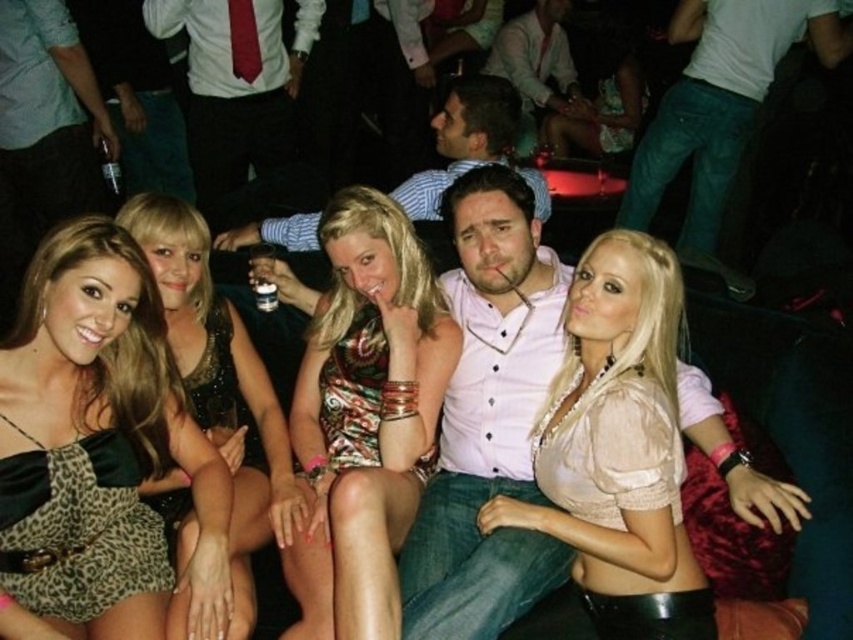
Question: Does satin beige blouse at center come behind leopard print fabric dress at lower left?

Choices:
 (A) yes
 (B) no

Answer: (B)

Question: Considering the relative positions of leopard print dress at left and printed fabric dress at center in the image provided, where is leopard print dress at left located with respect to printed fabric dress at center?

Choices:
 (A) below
 (B) above

Answer: (A)

Question: Which point is farther to the camera?

Choices:
 (A) black sequined dress at center
 (B) satin beige blouse at center
 (C) leopard print fabric dress at lower left

Answer: (A)

Question: Which object appears closest to the camera in this image?

Choices:
 (A) white cotton shirt at upper right
 (B) black sequined dress at center
 (C) leopard print dress at left
 (D) leopard print fabric dress at lower left

Answer: (D)

Question: Observing the image, what is the correct spatial positioning of white cotton shirt at upper right in reference to black sequined dress at center?

Choices:
 (A) below
 (B) above

Answer: (B)

Question: Which point is farther from the camera taking this photo?

Choices:
 (A) (4, 502)
 (B) (448, 124)

Answer: (B)